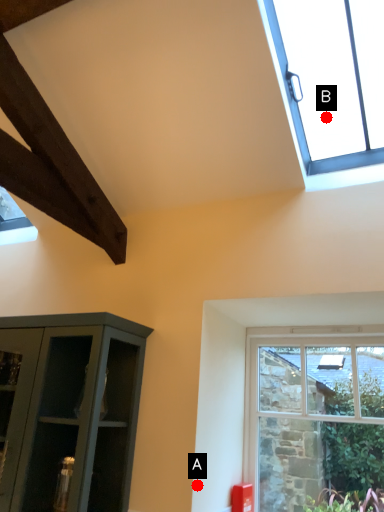
Question: Two points are circled on the image, labeled by A and B beside each circle. Which point is closer to the camera taking this photo?

Choices:
 (A) A is closer
 (B) B is closer

Answer: (A)